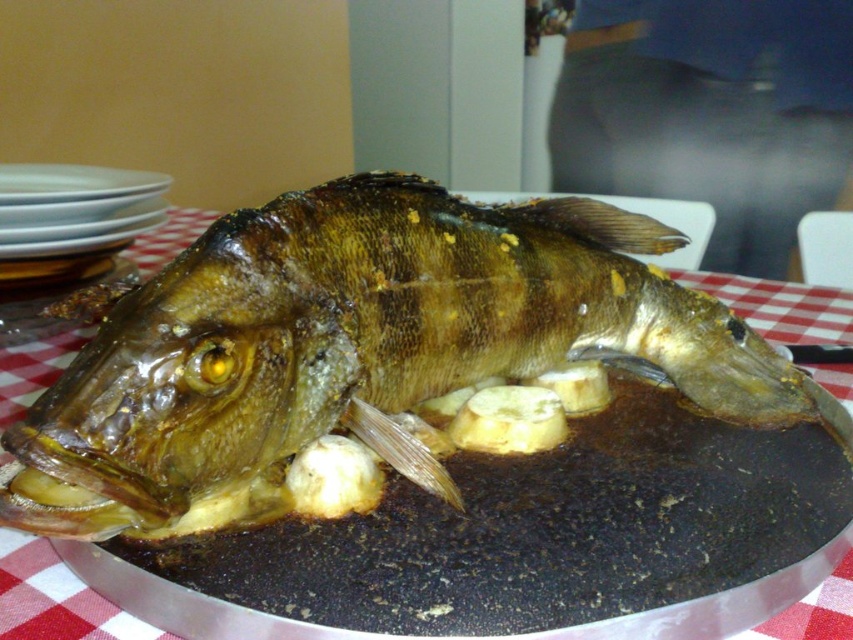
You are a waiter arranging a buffet table. You need to place the shiny brown fish at center and the white glossy plate at upper left in a specific order. According to the image, which object is positioned lower on the table?

The shiny brown fish at center is located below the white glossy plate at upper left, so the shiny brown fish at center is positioned lower on the table.

In the scene shown: You are looking at the roasted fish on the platter. Which of the two points, point (442,394) or point (73,176), is closer to your eyes?

Point (442,394) is closer to the camera than point (73,176).

You are holding a knife and want to cut the fish at point (x=321, y=282). If the knife can reach up to 15 inches, will it be able to reach that point?

The distance of point (x=321, y=282) from viewer is 16.12 inches, so the knife cannot reach it since it is further away than the knife can reach.